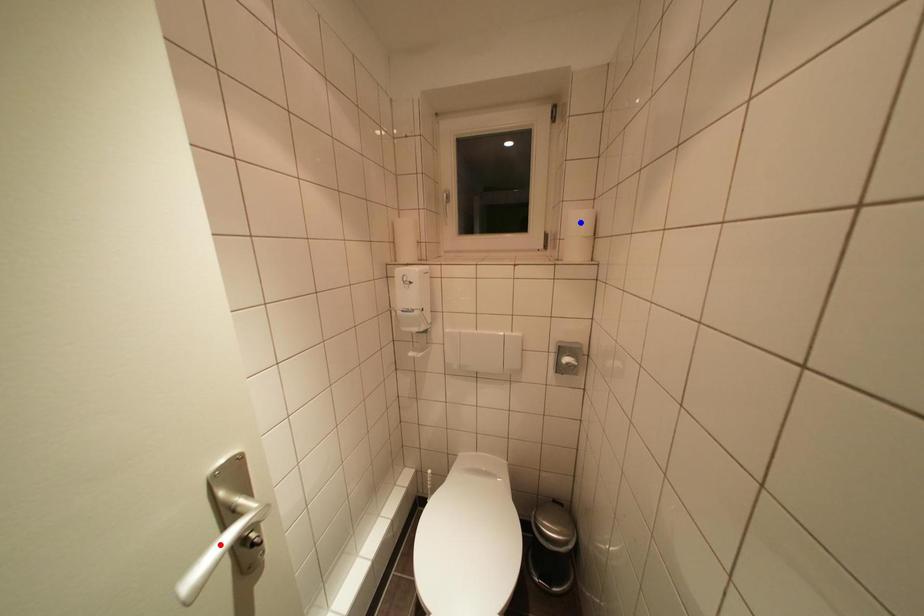
Question: Which of the two points in the image is closer to the camera?

Choices:
 (A) Blue point is closer.
 (B) Red point is closer.

Answer: (B)